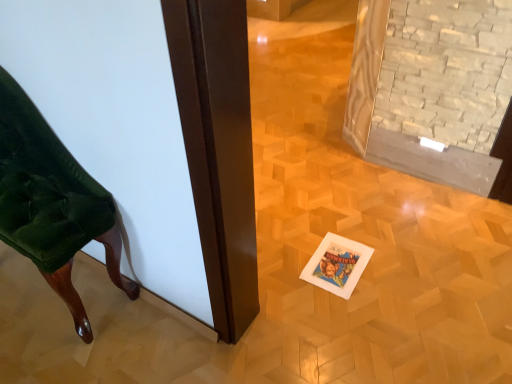
Question: From the image's perspective, would you say velvet green chair at left is positioned over white paper postcard at center?

Choices:
 (A) no
 (B) yes

Answer: (B)

Question: From a real-world perspective, is velvet green chair at left below white paper postcard at center?

Choices:
 (A) no
 (B) yes

Answer: (A)

Question: Considering the relative sizes of velvet green chair at left and white paper postcard at center in the image provided, is velvet green chair at left smaller than white paper postcard at center?

Choices:
 (A) no
 (B) yes

Answer: (A)

Question: Can white paper postcard at center be found inside velvet green chair at left?

Choices:
 (A) yes
 (B) no

Answer: (B)

Question: Is velvet green chair at left positioned with its back to white paper postcard at center?

Choices:
 (A) yes
 (B) no

Answer: (B)

Question: Could you tell me if velvet green chair at left is facing white paper postcard at center?

Choices:
 (A) yes
 (B) no

Answer: (B)

Question: Is white paper postcard at center positioned beyond the bounds of velvet green chair at left?

Choices:
 (A) yes
 (B) no

Answer: (A)

Question: From the image's perspective, is white paper postcard at center over velvet green chair at left?

Choices:
 (A) no
 (B) yes

Answer: (A)

Question: Is white paper postcard at center far from velvet green chair at left?

Choices:
 (A) no
 (B) yes

Answer: (A)

Question: Could you tell me if white paper postcard at center is turned towards velvet green chair at left?

Choices:
 (A) yes
 (B) no

Answer: (B)

Question: From a real-world perspective, is white paper postcard at center below velvet green chair at left?

Choices:
 (A) no
 (B) yes

Answer: (B)

Question: Can you confirm if white paper postcard at center is wider than velvet green chair at left?

Choices:
 (A) no
 (B) yes

Answer: (B)

Question: Considering the positions of velvet green chair at left and white paper postcard at center in the image, is velvet green chair at left wider or thinner than white paper postcard at center?

Choices:
 (A) thin
 (B) wide

Answer: (A)